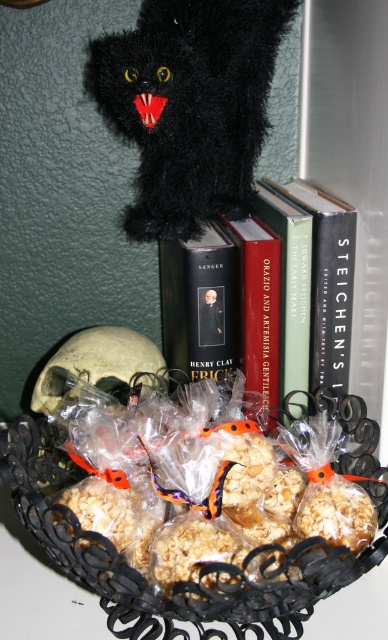
Question: Which of these objects is positioned farthest from the hardcover book at center?

Choices:
 (A) fuzzy black cat at upper center
 (B) black plastic basket at lower center

Answer: (B)

Question: Does black plastic basket at lower center have a larger size compared to hardcover book at center?

Choices:
 (A) yes
 (B) no

Answer: (B)

Question: Can you confirm if fuzzy black cat at upper center is bigger than black plastic basket at lower center?

Choices:
 (A) yes
 (B) no

Answer: (A)

Question: Which of the following is the closest to the observer?

Choices:
 (A) fuzzy black cat at upper center
 (B) black plastic basket at lower center
 (C) hardcover book at center

Answer: (B)

Question: Among these points, which one is farthest from the camera?

Choices:
 (A) (200, 362)
 (B) (148, 627)

Answer: (A)

Question: Can you confirm if fuzzy black cat at upper center is bigger than hardcover book at center?

Choices:
 (A) yes
 (B) no

Answer: (A)